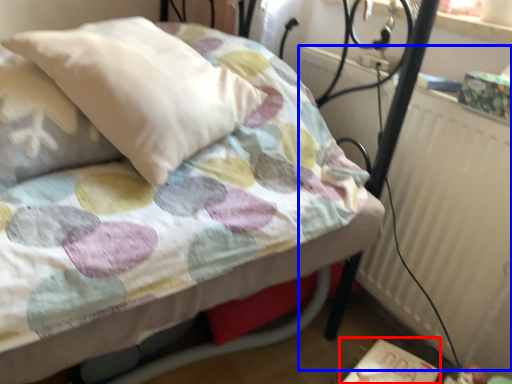
Question: Which object appears farthest to the camera in this image, table (highlighted by a red box) or radiator (highlighted by a blue box)?

Choices:
 (A) table
 (B) radiator

Answer: (A)